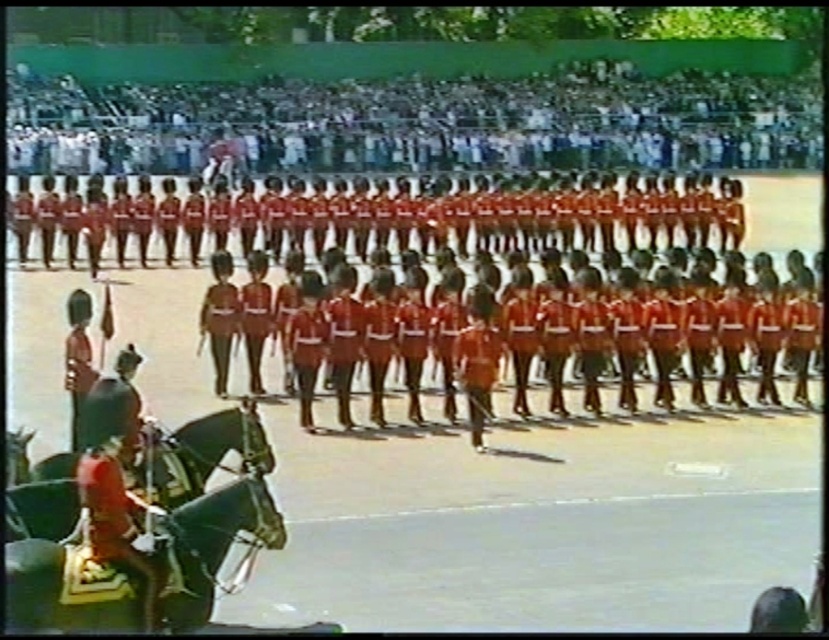
You are a photographer at the military parade. You want to capture a photo where both the shiny red uniform at center and the black glossy horse at lower left are visible. Based on their positions, which object should be placed higher in the frame to include both?

The shiny red uniform at center is above the black glossy horse at lower left, so to include both in the photo, the photographer should position the frame so the shiny red uniform at center is higher up while still capturing the black glossy horse at lower left at the lower part of the frame.

You are a photographer positioned at point (62,570). You want to capture a photo of the shiny black horse at lower left. What direction should you face to ensure the horse is centered in your viewfinder?

You should face towards the lower left direction to center the shiny black horse at lower left in your viewfinder.